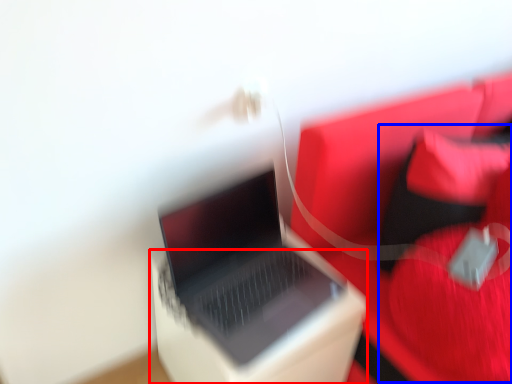
Question: Which point is further to the camera, cardboard box (highlighted by a red box) or bean bag chair (highlighted by a blue box)?

Choices:
 (A) cardboard box
 (B) bean bag chair

Answer: (A)